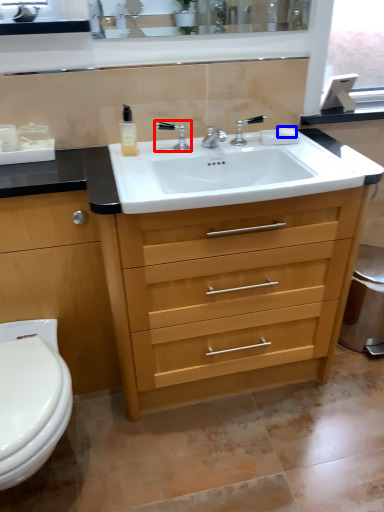
Question: Which point is further to the camera, tap (highlighted by a red box) or soap (highlighted by a blue box)?

Choices:
 (A) tap
 (B) soap

Answer: (B)